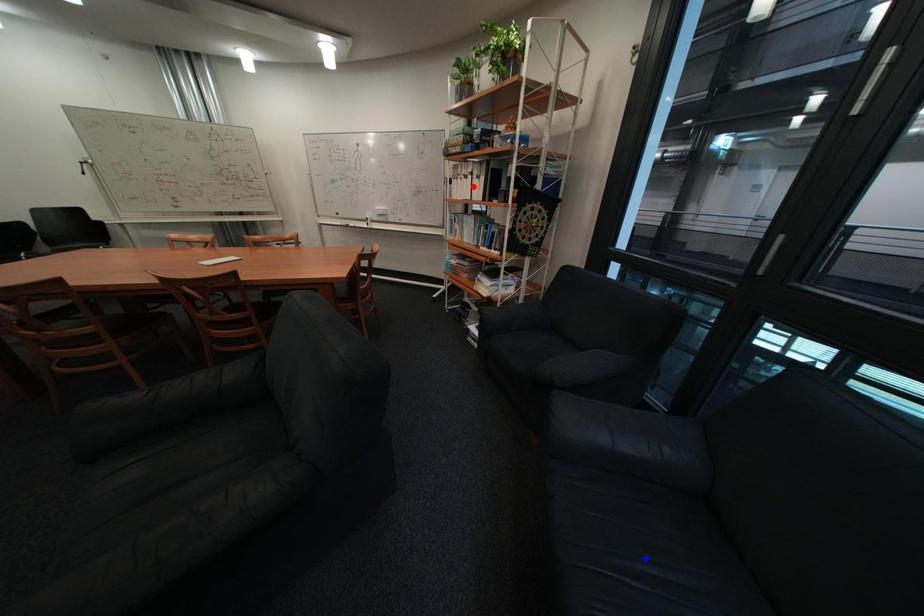
Question: In the image, two points are highlighted. Which point is nearer to the camera? Reply with the corresponding letter.

Choices:
 (A) blue point
 (B) red point

Answer: (A)